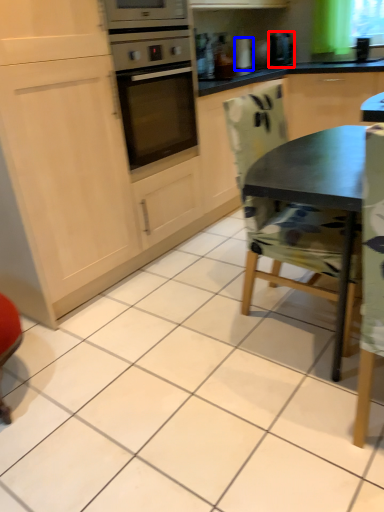
Question: Among these objects, which one is farthest to the camera, coffee machine (highlighted by a red box) or appliance (highlighted by a blue box)?

Choices:
 (A) coffee machine
 (B) appliance

Answer: (B)